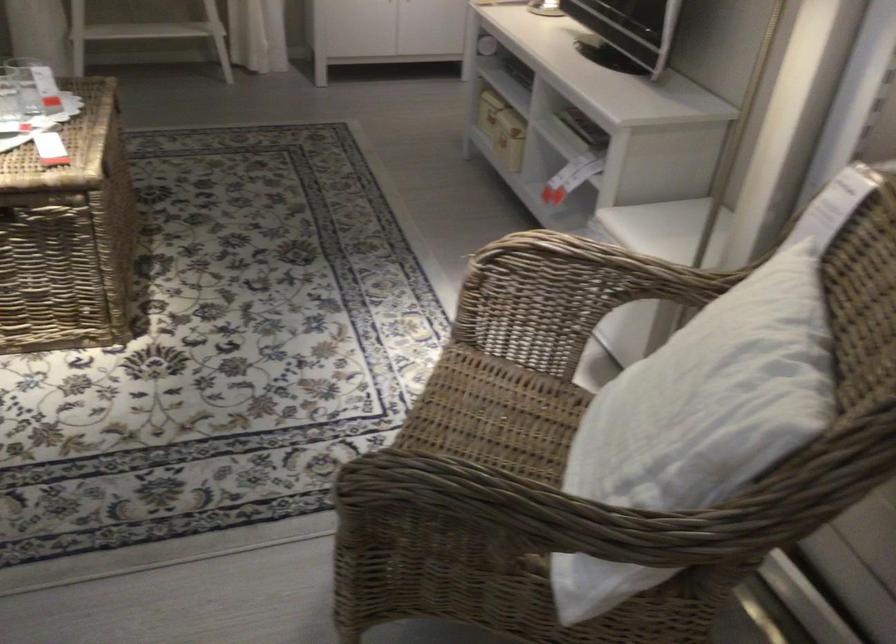
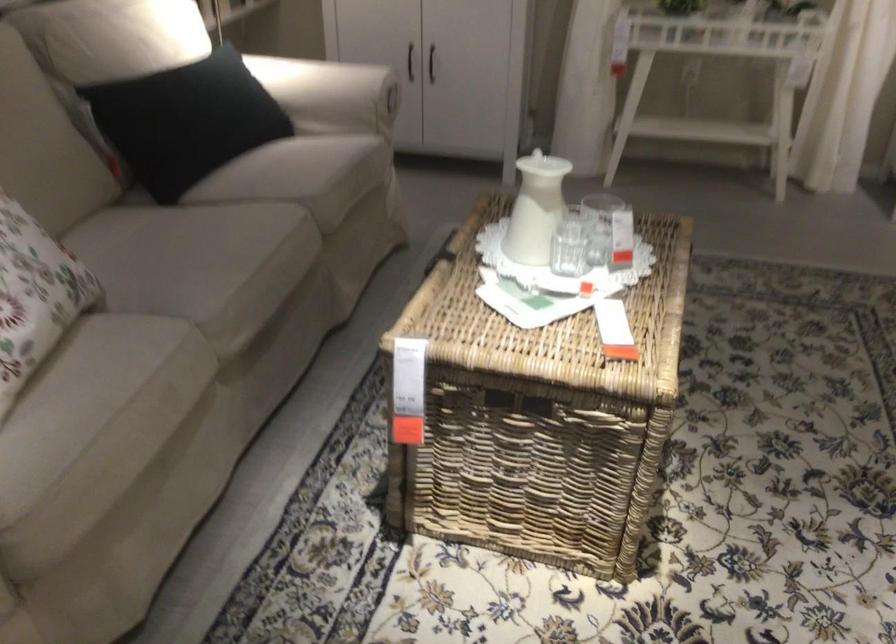
Question: The images are taken continuously from a first-person perspective. In which direction is your viewpoint rotating?

Choices:
 (A) Left
 (B) Right
 (C) Up
 (D) Down

Answer: (A)